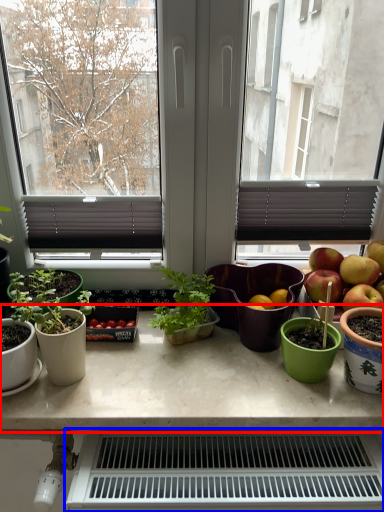
Question: Which object appears farthest to the camera in this image, table (highlighted by a red box) or appliance (highlighted by a blue box)?

Choices:
 (A) table
 (B) appliance

Answer: (A)